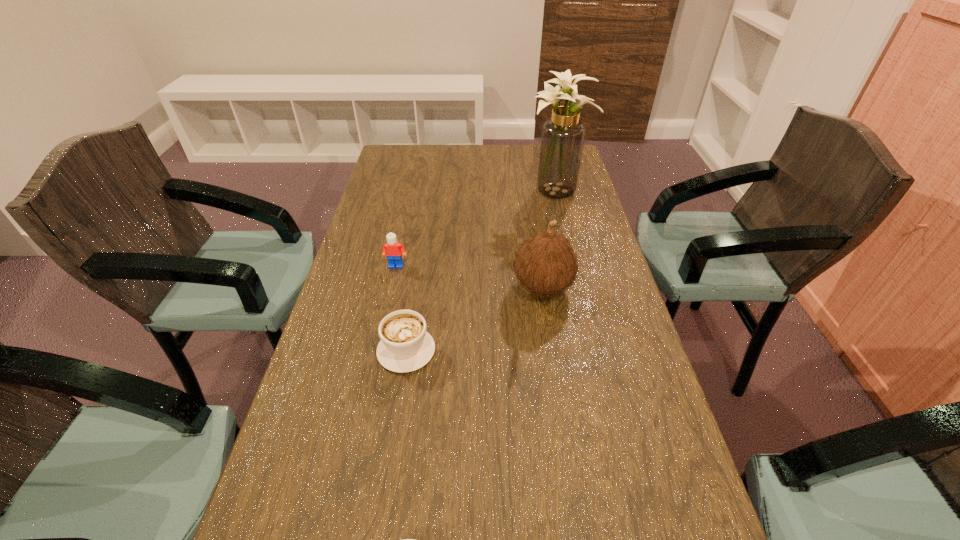
Where is `vacant space located on the face of the Lego`? This screenshot has height=540, width=960. vacant space located on the face of the Lego is located at coordinates (372, 377).

Where is `vacant space situated 0.320m to the right of the fourth farthest object's handle`? vacant space situated 0.320m to the right of the fourth farthest object's handle is located at coordinates (422, 245).

This screenshot has width=960, height=540. Identify the location of vacant space positioned to the right of the fourth farthest object's handle. (412, 312).

What are the coordinates of `blank space located 0.050m to the right of the fourth farthest object's handle` in the screenshot? It's located at (412, 312).

Locate an element on the screen. The width and height of the screenshot is (960, 540). Lego present at the left edge is located at coordinates coord(394,251).

The image size is (960, 540). What are the coordinates of `cappuccino at the left edge` in the screenshot? It's located at (405, 346).

You are a GUI agent. You are given a task and a screenshot of the screen. Output one action in this format:
    pyautogui.click(x=<x>, y=<y>)
    Task: Click on the flower arrangement that is at the right edge
    This screenshot has height=540, width=960.
    Given the screenshot: What is the action you would take?
    pyautogui.click(x=562, y=140)

Identify the location of coconut that is at the right edge. Image resolution: width=960 pixels, height=540 pixels. (546, 264).

Where is `vacant region at the far edge`? The image size is (960, 540). vacant region at the far edge is located at coordinates (441, 146).

The height and width of the screenshot is (540, 960). In the image, there is a desktop. In order to click on free region at the left edge in this screenshot , I will do `click(367, 322)`.